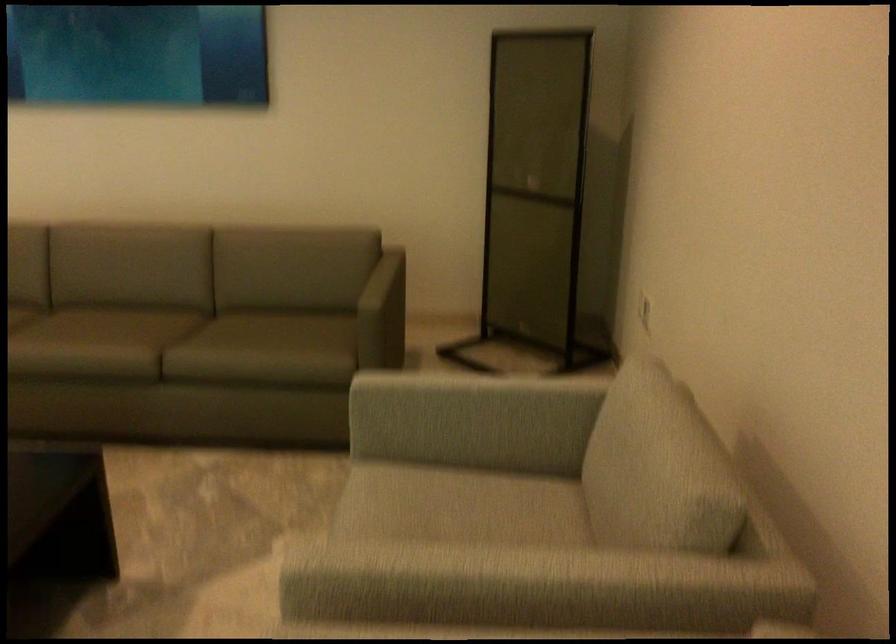
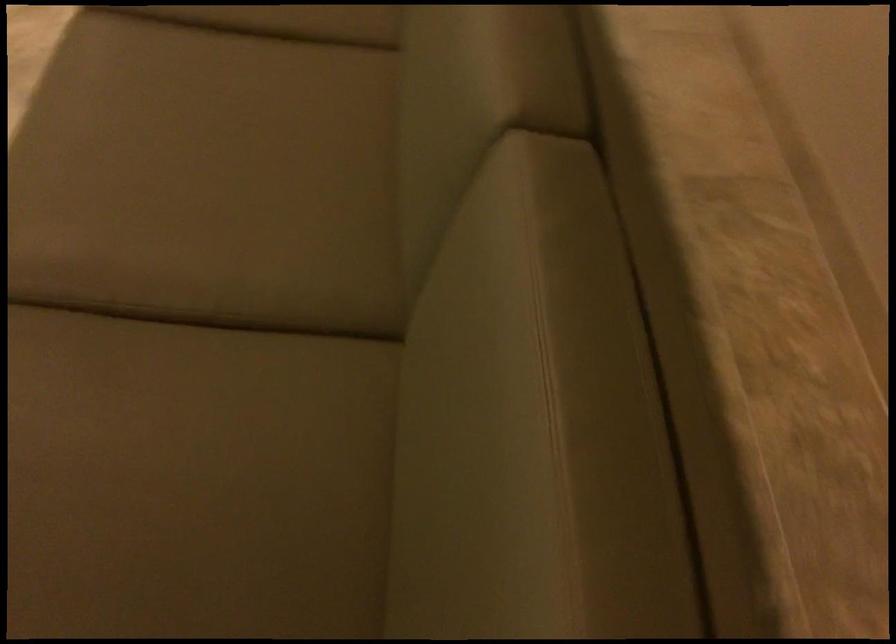
In the second image, find the point that corresponds to pixel 176 330 in the first image.

(211, 339)